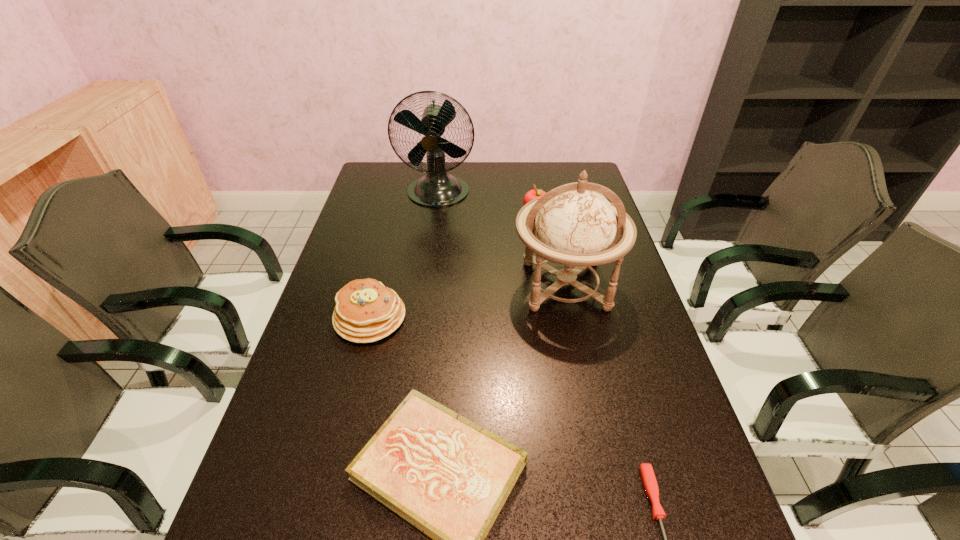
Identify the location of pancake that is at the left edge. The image size is (960, 540). (366, 311).

Find the location of a particular element. object at the right edge is located at coordinates (575, 225).

Where is `object located in the far left corner section of the desktop`? The width and height of the screenshot is (960, 540). object located in the far left corner section of the desktop is located at coordinates click(x=438, y=188).

At what (x,y) coordinates should I click in order to perform the action: click on vacant space at the far edge of the desktop. Please return your answer as a coordinate pair (x, y). The height and width of the screenshot is (540, 960). Looking at the image, I should click on (508, 188).

Where is `free space at the left edge of the desktop`? Image resolution: width=960 pixels, height=540 pixels. free space at the left edge of the desktop is located at coordinates tap(275, 424).

Identify the location of vacant space at the far right corner of the desktop. The height and width of the screenshot is (540, 960). (567, 166).

You are a GUI agent. You are given a task and a screenshot of the screen. Output one action in this format:
    pyautogui.click(x=<x>, y=<y>)
    Task: Click on the vacant space that is in between the apple and the fan
    This screenshot has width=960, height=540.
    Given the screenshot: What is the action you would take?
    pyautogui.click(x=487, y=202)

Where is `free space between the pancake and the globe`? The width and height of the screenshot is (960, 540). free space between the pancake and the globe is located at coordinates (468, 301).

The image size is (960, 540). Identify the location of free space between the fan and the globe. (501, 239).

The height and width of the screenshot is (540, 960). Identify the location of unoccupied area between the fan and the apple. (487, 202).